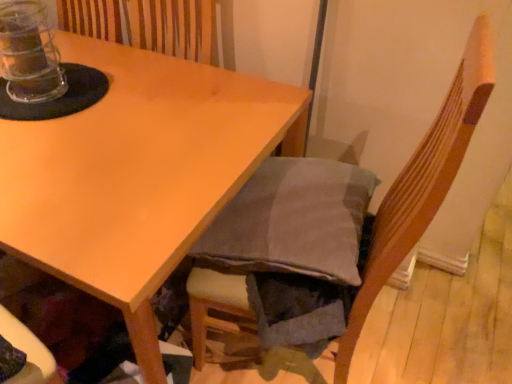
Where is `free space in front of transparent plastic jar at top left`? free space in front of transparent plastic jar at top left is located at coordinates (38, 132).